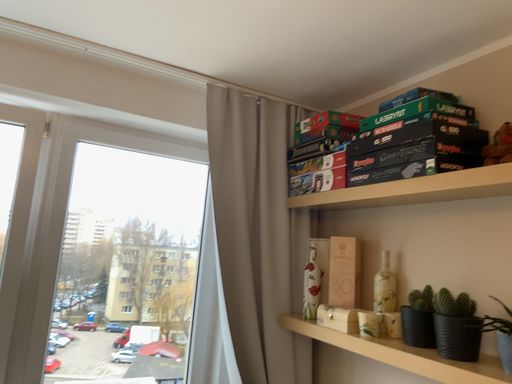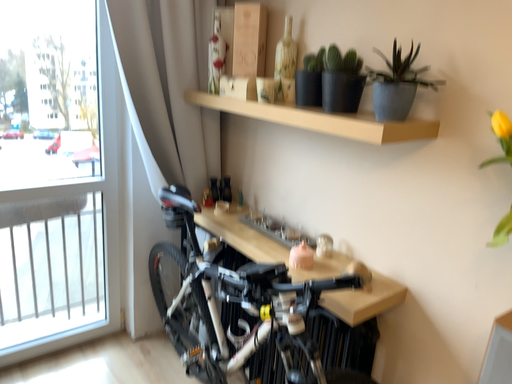
Question: How did the camera likely rotate when shooting the video?

Choices:
 (A) rotated downward
 (B) rotated upward

Answer: (A)